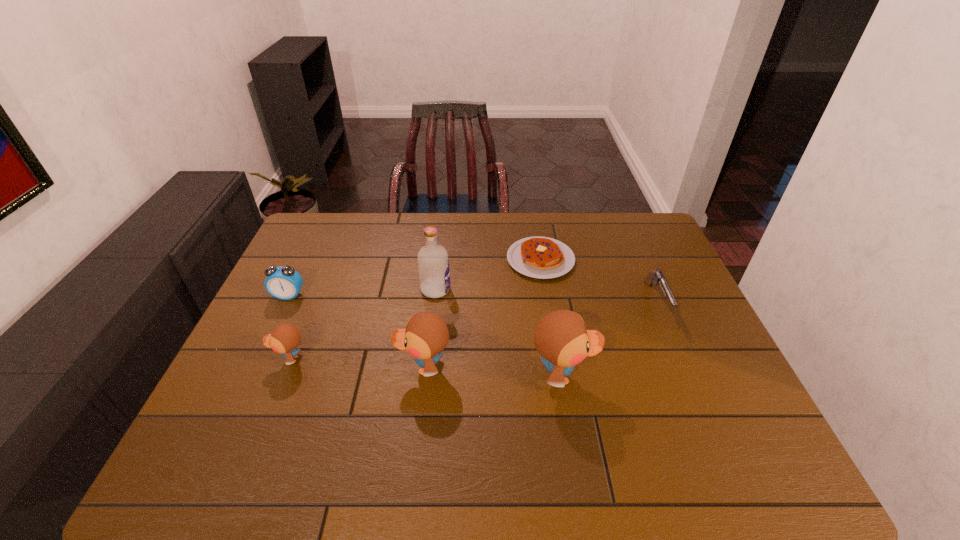
Considering the uniform spacing of ducks, where should an additional duck be positioned on the right? Please locate a free spot. Please provide its 2D coordinates. Your answer should be formatted as a tuple, i.e. [(x, y)], where the tuple contains the x and y coordinates of a point satisfying the conditions above.

[(706, 384)]